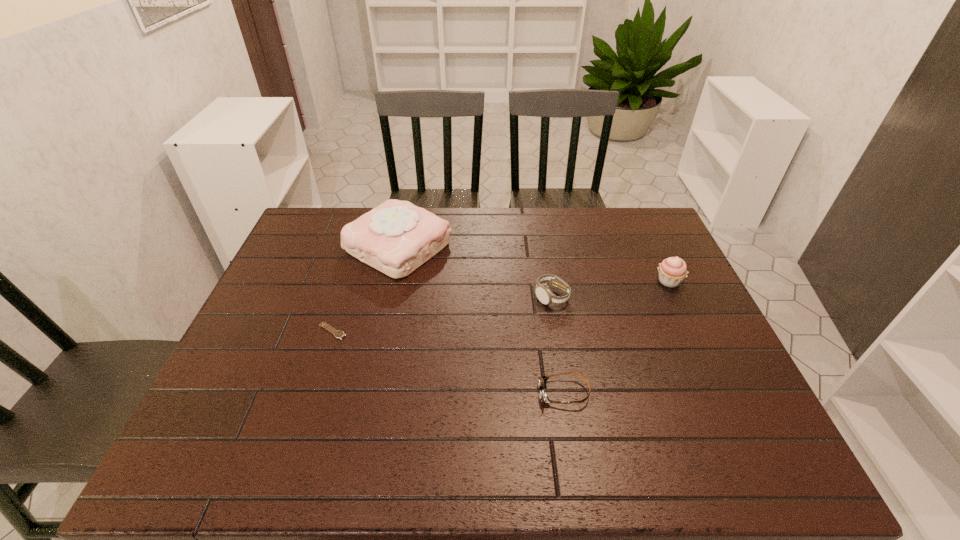
Locate an element on the screen. The image size is (960, 540). vacant region located 0.250m on the left of the rightmost object is located at coordinates (568, 281).

The image size is (960, 540). In order to click on vacant space located 0.380m on the face of the third shortest object in this screenshot , I will do `click(576, 440)`.

The height and width of the screenshot is (540, 960). I want to click on free space located on the front-facing side of the fourth tallest object, so click(x=465, y=393).

Locate an element on the screen. vacant space located 0.340m on the front-facing side of the fourth tallest object is located at coordinates (391, 393).

Find the location of a particular element. free space located 0.190m on the front-facing side of the fourth tallest object is located at coordinates (456, 393).

Identify the location of vacant point located on the front of the shorter watch. (309, 402).

Where is `object present at the far edge`? This screenshot has width=960, height=540. object present at the far edge is located at coordinates (396, 237).

The image size is (960, 540). I want to click on object that is at the right edge, so click(672, 271).

The width and height of the screenshot is (960, 540). In the image, there is a desktop. In order to click on vacant space at the far edge in this screenshot , I will do `click(541, 213)`.

The image size is (960, 540). I want to click on free space at the near edge of the desktop, so click(x=292, y=476).